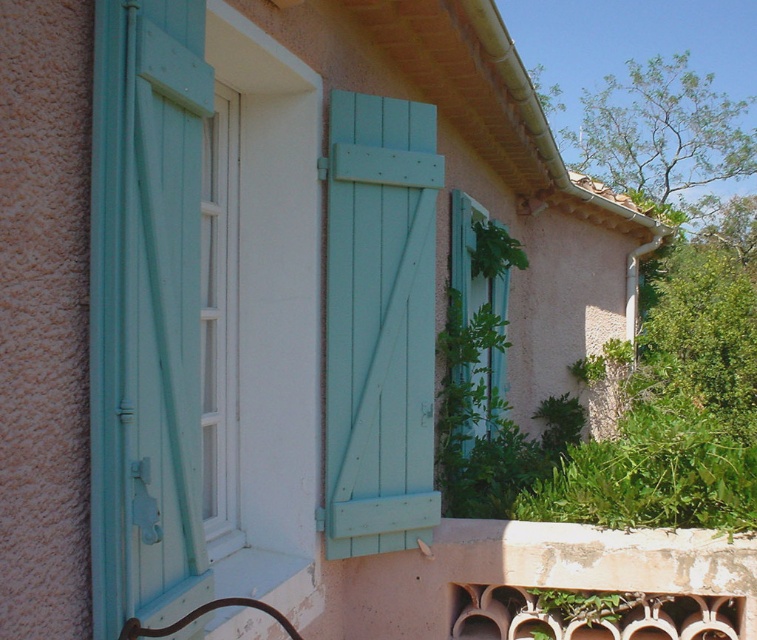
Is light blue wood shutter at center smaller than white wood window at center?

No, light blue wood shutter at center is not smaller than white wood window at center.

Which is behind, point (391, 534) or point (223, 348)?

Point (391, 534)

The height and width of the screenshot is (640, 757). Find the location of `light blue wood shutter at center`. light blue wood shutter at center is located at coordinates (379, 323).

Who is positioned more to the left, light blue wood shutter at center or green leafy plant at lower right?

light blue wood shutter at center

Does light blue wood shutter at center have a smaller size compared to green leafy plant at lower right?

Indeed, light blue wood shutter at center has a smaller size compared to green leafy plant at lower right.

Which is behind, point (372, 180) or point (625, 420)?

The point (625, 420) is more distant.

At what (x,y) coordinates should I click in order to perform the action: click on light blue wood shutter at center. Please return your answer as a coordinate pair (x, y). Looking at the image, I should click on (379, 323).

Measure the distance between teal wood shutter at left and teal wood window at center.

A distance of 9.02 feet exists between teal wood shutter at left and teal wood window at center.

Is teal wood shutter at left thinner than teal wood window at center?

Indeed, teal wood shutter at left has a lesser width compared to teal wood window at center.

Find the location of a particular element. This screenshot has height=640, width=757. teal wood shutter at left is located at coordinates (145, 310).

Identify the location of teal wood shutter at left. The height and width of the screenshot is (640, 757). click(145, 310).